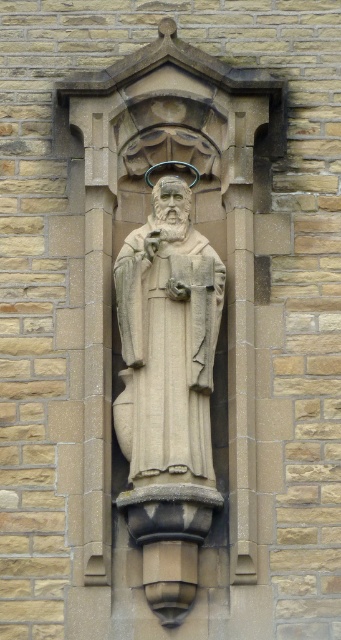
Is beige stone statue at center smaller than smooth stone robe at center?

No, beige stone statue at center is not smaller than smooth stone robe at center.

Which is in front, point (165, 184) or point (164, 320)?

Point (164, 320) is more forward.

Locate an element on the screen. Image resolution: width=341 pixels, height=640 pixels. beige stone statue at center is located at coordinates (170, 344).